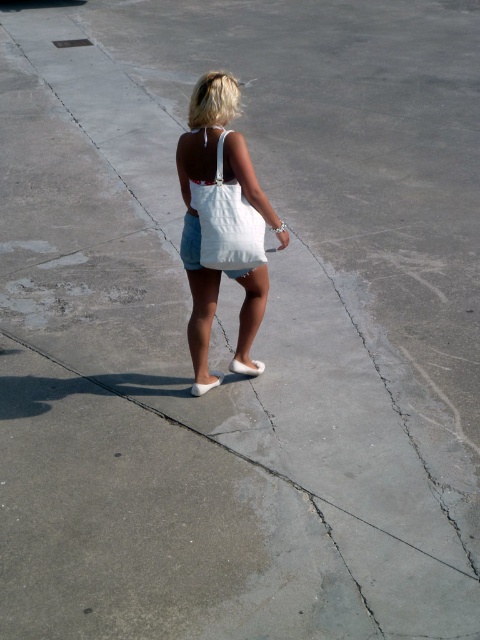
Looking at this image, you are a delivery person who needs to place a white canvas bag at center and a white suede sandal at center into a storage box. The box can only fit items that are no taller than 12 inches. Based on the scene, can both items fit vertically in the box?

The white canvas bag at center is much taller than the white suede sandal at center. If the canvas bag exceeds 12 inches in height, it won cannot fit in the box. However, the sandal might fit if its height is under 12 inches. Without exact measurements, it is uncertain if both can fit vertically.

You are a photographer setting up a shoot in the described scene. You have to place a small prop exactly between the white canvas bag at center and the white suede sandal at lower center. Based on their positions, on which side of the sandal should you place the prop?

The white canvas bag at center is positioned on the right side of the white suede sandal at lower center, so the prop should be placed to the right of the white suede sandal at lower center.

You are a delivery person who needs to place a small package in either the white canvas bag at center or the white suede sandal at lower center. Based on their sizes, which one can fit the package?

The white canvas bag at center is bigger than the white suede sandal at lower center, so the small package can fit in the white canvas bag at center.